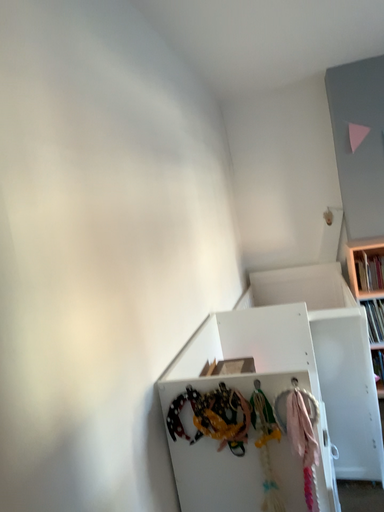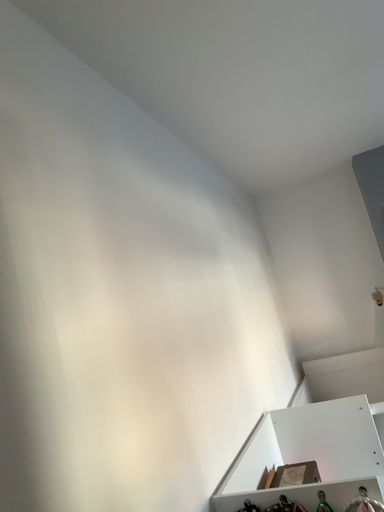
Question: Which way did the camera rotate in the video?

Choices:
 (A) rotated upward
 (B) rotated downward

Answer: (A)